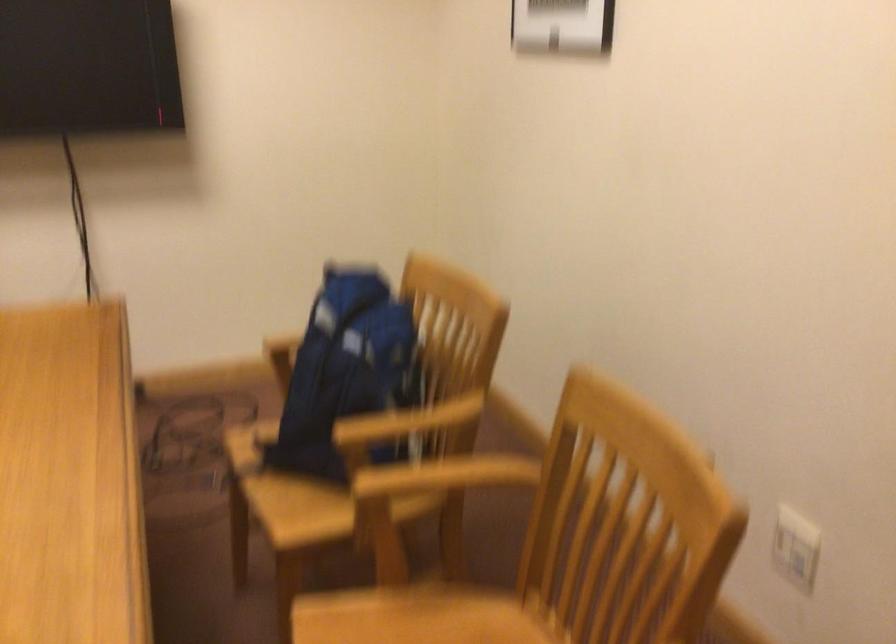
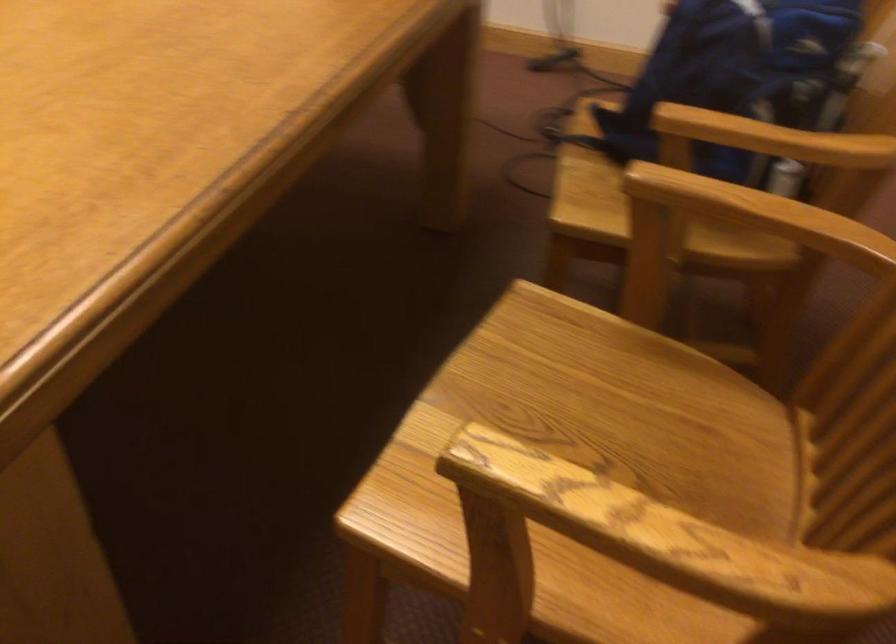
How did the camera likely rotate?

The camera rotated toward left-down.